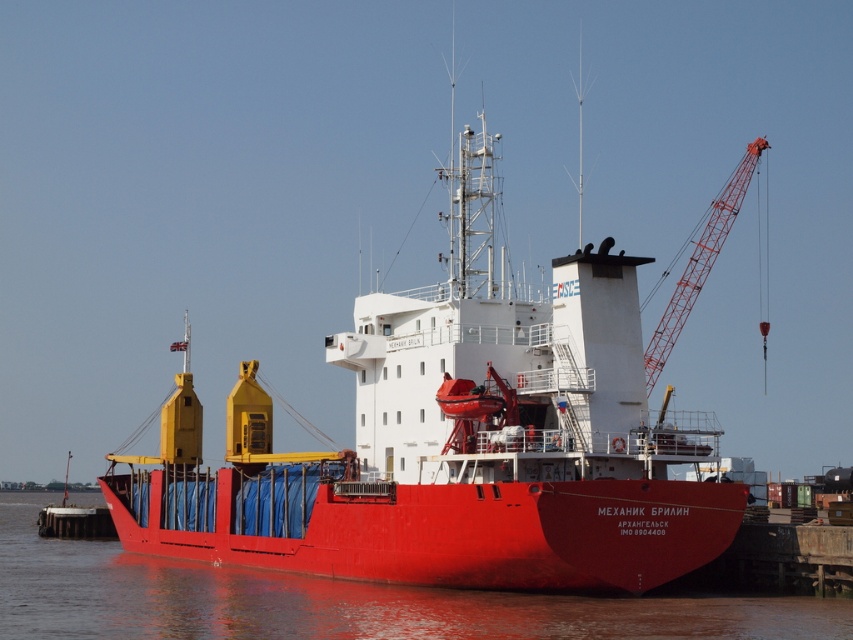
You are a harbor inspector checking the docking arrangements. You need to determine if the shiny red ship at center can move forward without hitting the red metal crane at upper right. Based on their positions, what should you advise?

The shiny red ship at center is in front of the red metal crane at upper right, so moving forward would bring it closer to the crane. Advise against moving forward to prevent collision.

You are a crane operator on the red metal crane at upper right. You need to lower a heavy container into the glossy water at ship center. Can you safely lower the container into the water without hitting the crane itself?

The glossy water at ship center is wider than the red metal crane at upper right, so yes, you can safely lower the container into the glossy water at ship center without hitting the crane itself.

You are a port worker standing on the dock. You need to board the shiny red ship at center using a gangway. The gangway can extend up to 75 meters. Will you be able to reach the ship?

The shiny red ship at center is 78.56 meters away from the viewer. Since the gangway can only extend up to 75 meters, it will not be sufficient to reach the ship.